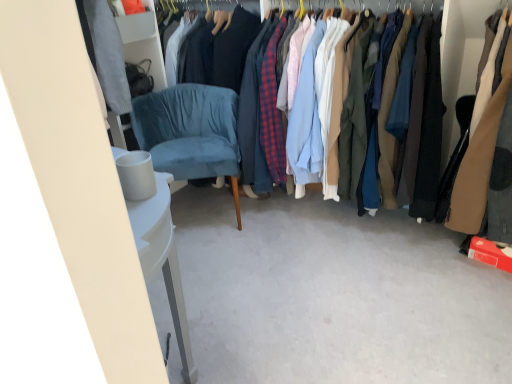
You are a GUI agent. You are given a task and a screenshot of the screen. Output one action in this format:
    pyautogui.click(x=<x>, y=<y>)
    Task: Click on the free space between matte cotton shirts at center, which is counted as the 2th clothing, starting from the right, and velvet blue armchair at center-left
    Image resolution: width=512 pixels, height=384 pixels.
    Given the screenshot: What is the action you would take?
    pyautogui.click(x=283, y=246)